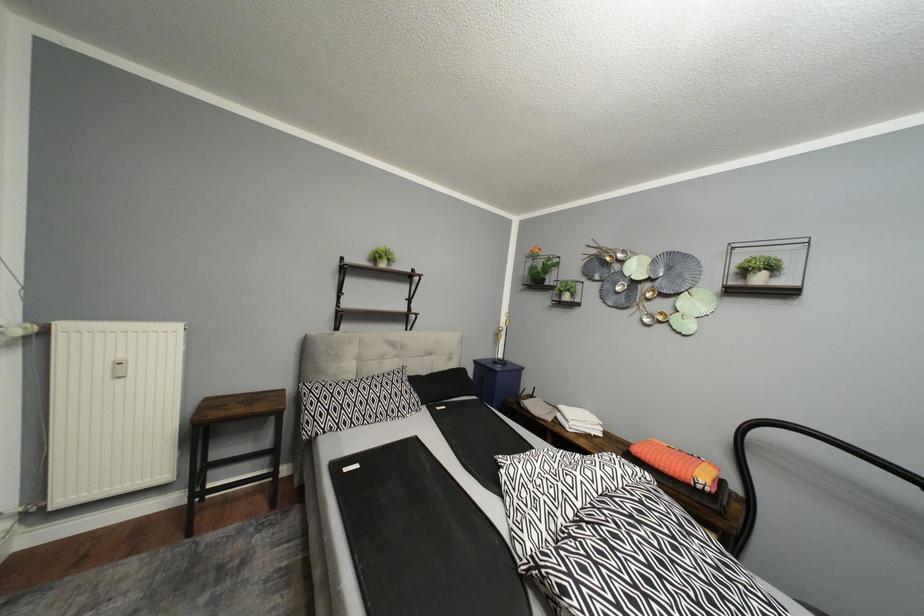
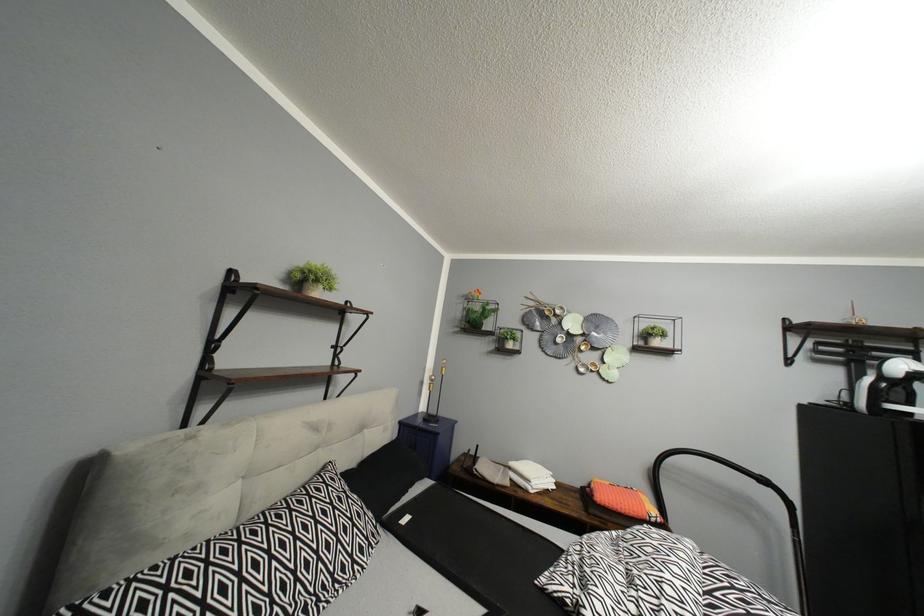
Question: How did the camera likely rotate?

Choices:
 (A) Left
 (B) Right
 (C) Up
 (D) Down

Answer: (B)